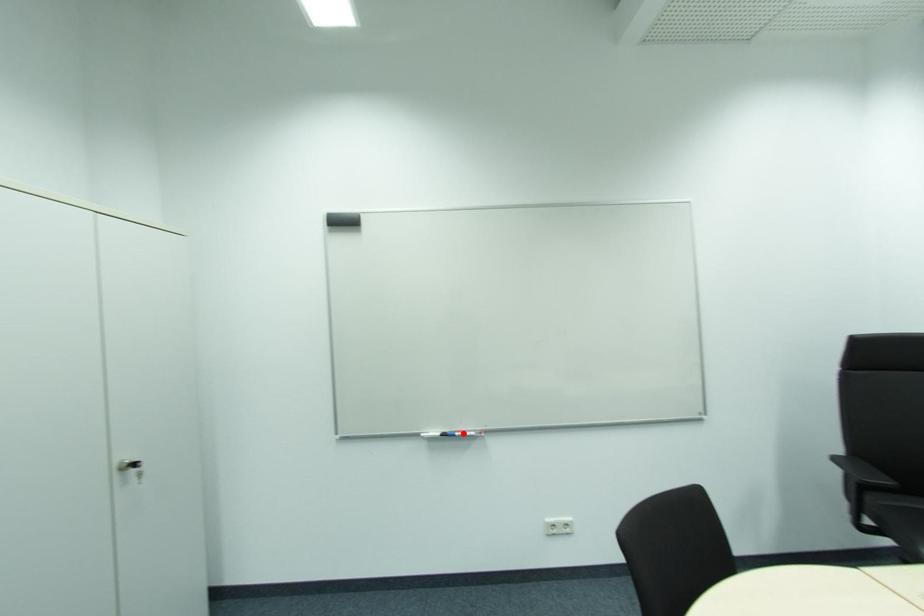
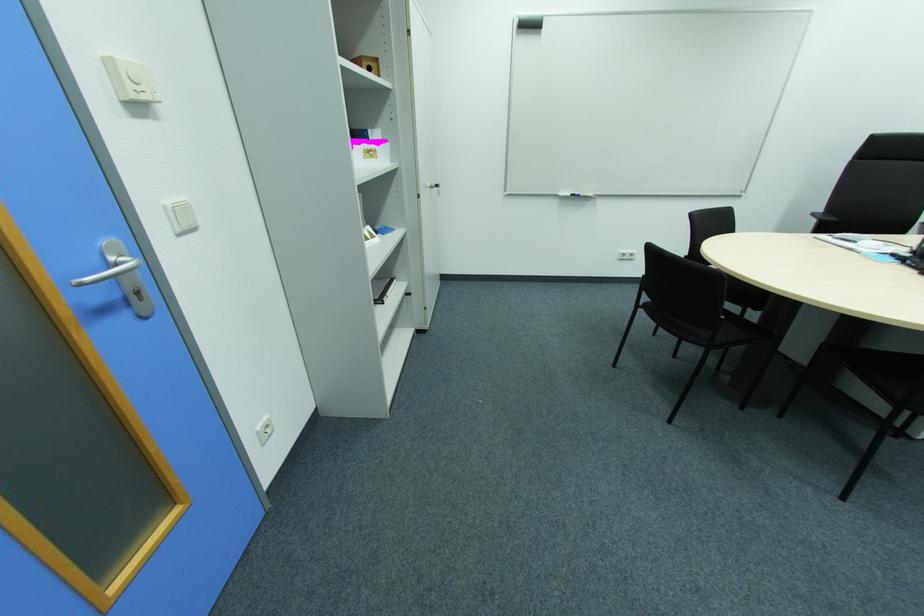
Find the pixel in the second image that matches the highlighted location in the first image.

(588, 195)